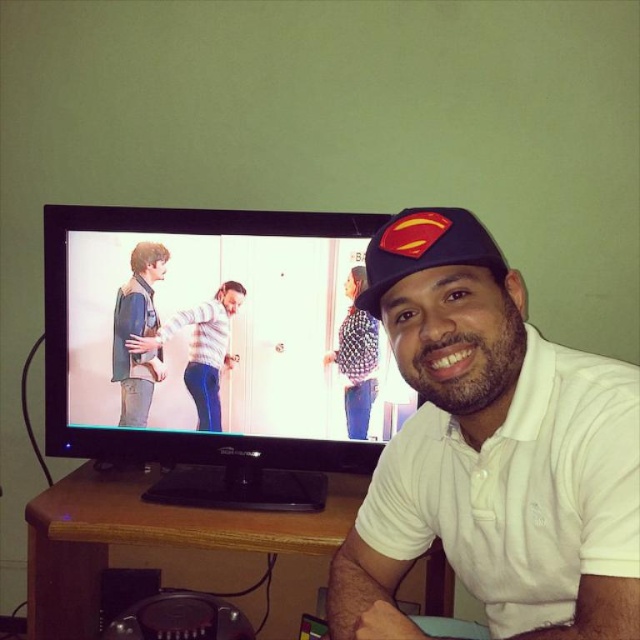
Is white cotton polo shirt at center to the left of striped sweater at center from the viewer's perspective?

Incorrect, white cotton polo shirt at center is not on the left side of striped sweater at center.

Who is taller, white cotton polo shirt at center or striped sweater at center?

white cotton polo shirt at center is taller.

Image resolution: width=640 pixels, height=640 pixels. Find the location of `white cotton polo shirt at center`. white cotton polo shirt at center is located at coordinates (492, 451).

Where is `white cotton polo shirt at center`? The height and width of the screenshot is (640, 640). white cotton polo shirt at center is located at coordinates (492, 451).

Who is more forward, (x=131, y=426) or (x=355, y=397)?

Positioned in front is point (x=355, y=397).

Between point (132, 292) and point (378, 333), which one is positioned in front?

Positioned in front is point (378, 333).

This screenshot has height=640, width=640. In order to click on denim jacket at left in this screenshot , I will do `click(138, 333)`.

Describe the element at coordinates (202, 348) in the screenshot. I see `striped sweater at center` at that location.

Does striped sweater at center have a larger size compared to patterned fabric shirt at center?

Yes.

Locate an element on the screen. The height and width of the screenshot is (640, 640). striped sweater at center is located at coordinates (202, 348).